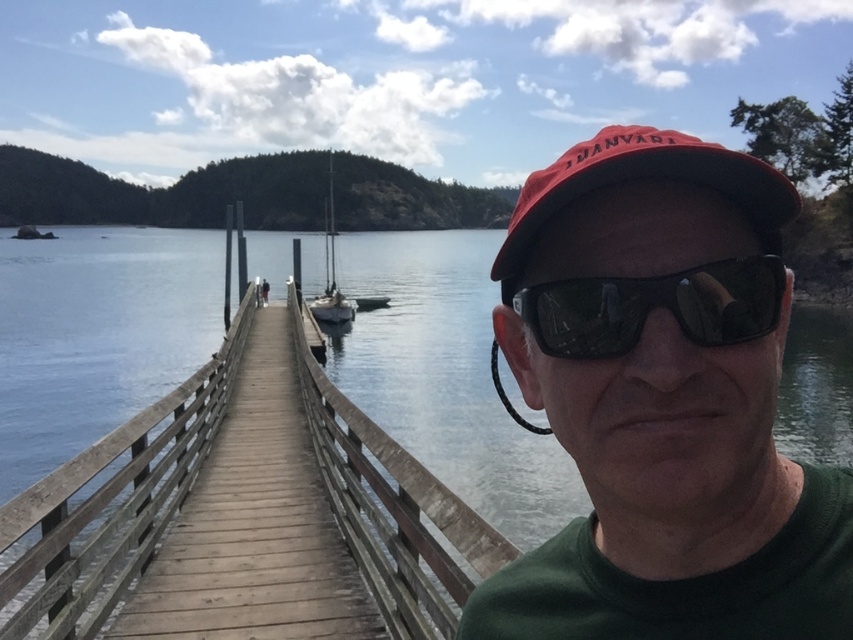
Does red matte baseball cap at center appear under white glossy sailboat at center?

Indeed, red matte baseball cap at center is positioned under white glossy sailboat at center.

Is the position of red matte baseball cap at center less distant than that of white glossy sailboat at center?

Yes, red matte baseball cap at center is closer to the viewer.

What do you see at coordinates (645, 177) in the screenshot?
I see `red matte baseball cap at center` at bounding box center [645, 177].

Find the location of a particular element. red matte baseball cap at center is located at coordinates (645, 177).

Can you confirm if matte red cap at center is shorter than black reflective sunglasses at center?

In fact, matte red cap at center may be taller than black reflective sunglasses at center.

Is matte red cap at center thinner than black reflective sunglasses at center?

No, matte red cap at center is not thinner than black reflective sunglasses at center.

Identify the location of matte red cap at center. The width and height of the screenshot is (853, 640). (663, 403).

Who is positioned more to the right, matte red cap at center or white glossy sailboat at center?

Positioned to the right is matte red cap at center.

The image size is (853, 640). In order to click on matte red cap at center in this screenshot , I will do `click(663, 403)`.